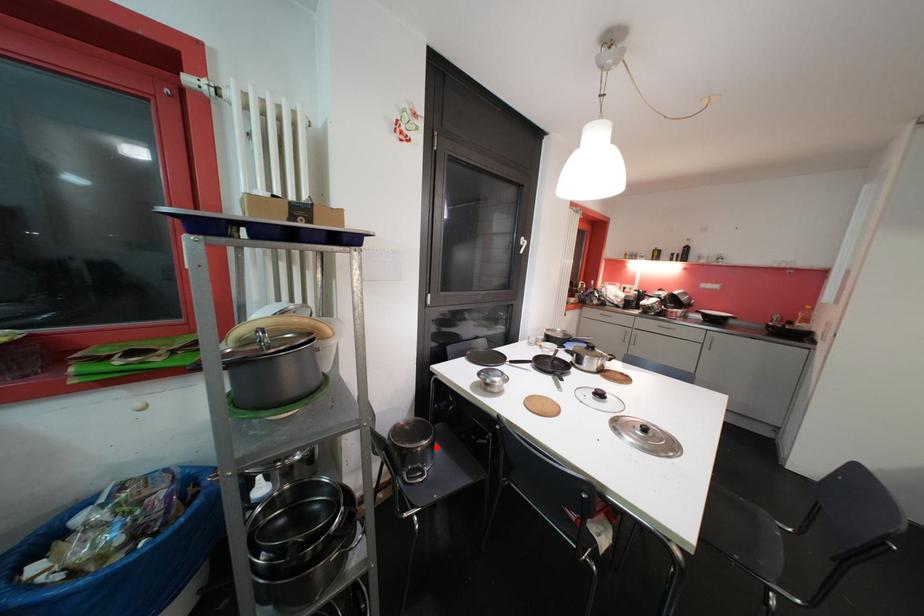
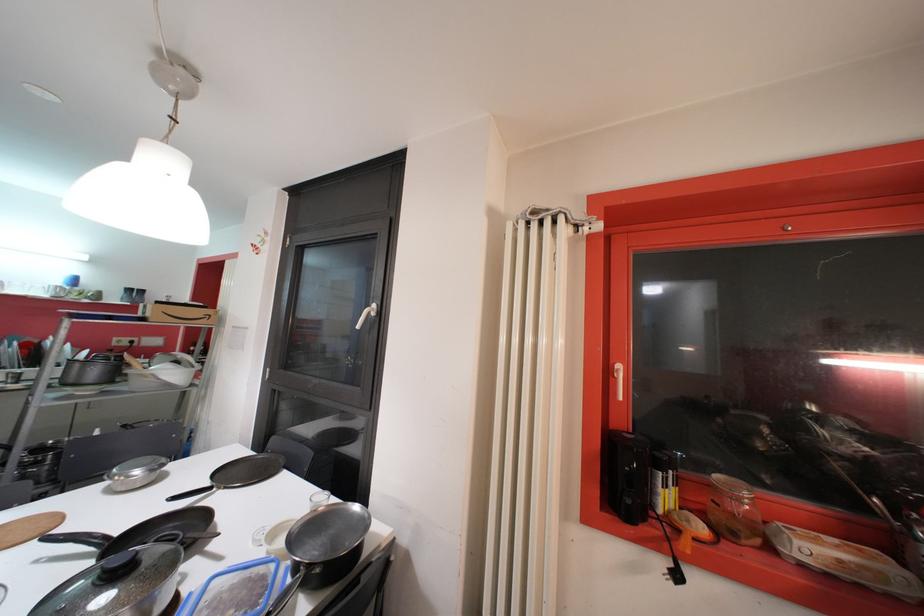
Question: I am providing you with two images of the same scene from different viewpoints. A red point is marked on the first image. Can you still see the location of the red point in image 2?

Choices:
 (A) Yes
 (B) No

Answer: (B)